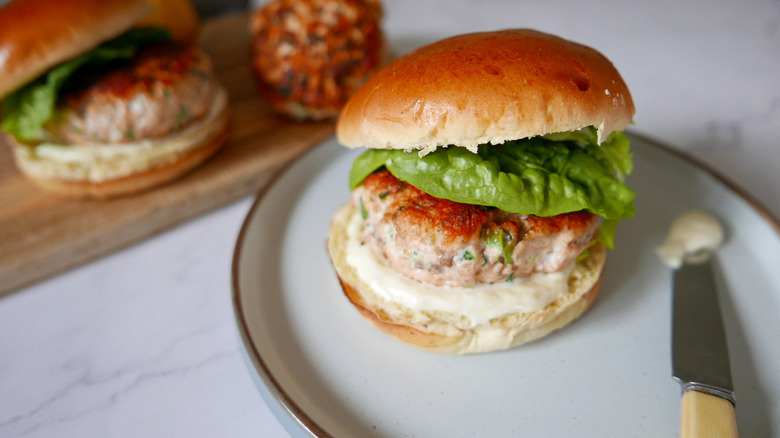
Find the location of a particular element. The image size is (780, 438). plate is located at coordinates (534, 433).